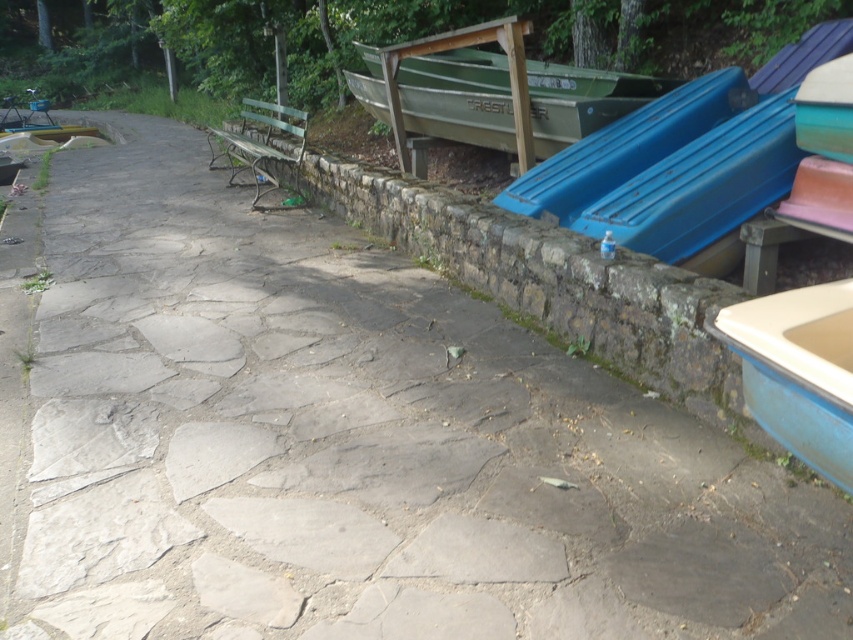
You are a visitor at a marina and want to board the closest boat. You see the blue metallic boat at right and the green matte boat at upper center. Which one is closer to you?

The green matte boat at upper center is closer to you than the blue metallic boat at right.

You are standing on the stone pathway and want to walk towards the boats. Which boat, the blue metallic boat at right or the green matte boat at upper center, will you reach first?

The blue metallic boat at right is in front of the green matte boat at upper center, so you will reach the blue metallic boat at right first.